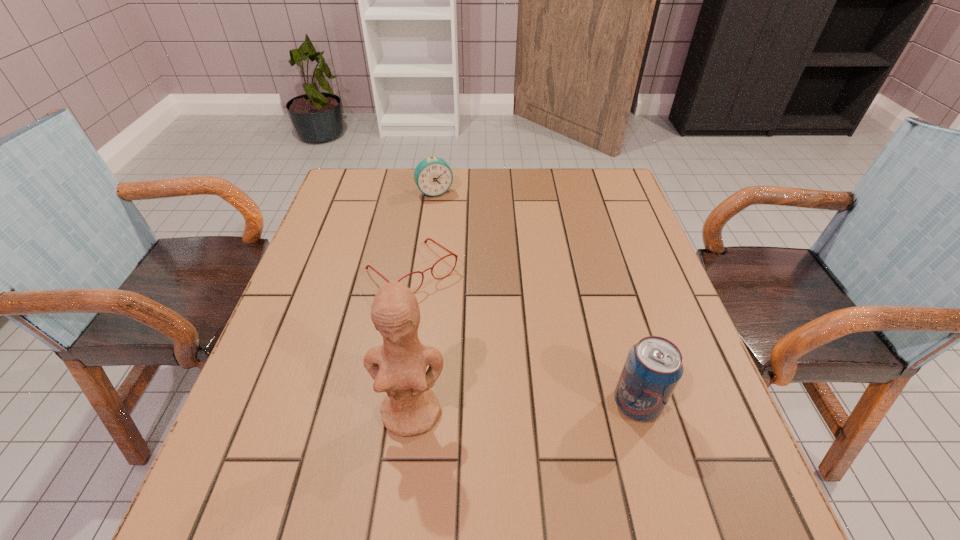
Locate an element on the screen. free spot on the desktop that is between the tallest object and the rightmost object and is positioned on the face of the spectacles is located at coordinates (548, 407).

You are a GUI agent. You are given a task and a screenshot of the screen. Output one action in this format:
    pyautogui.click(x=<x>, y=<y>)
    Task: Click on the free space on the desktop that is between the figurine and the second tallest object and is positioned on the front-facing side of the alarm clock
    
    Given the screenshot: What is the action you would take?
    pyautogui.click(x=540, y=407)